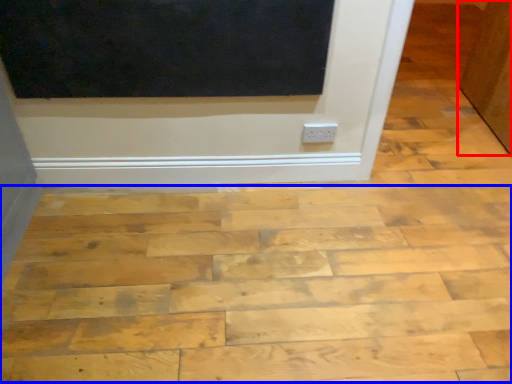
Question: Which point is further to the camera, door (highlighted by a red box) or plywood (highlighted by a blue box)?

Choices:
 (A) door
 (B) plywood

Answer: (A)